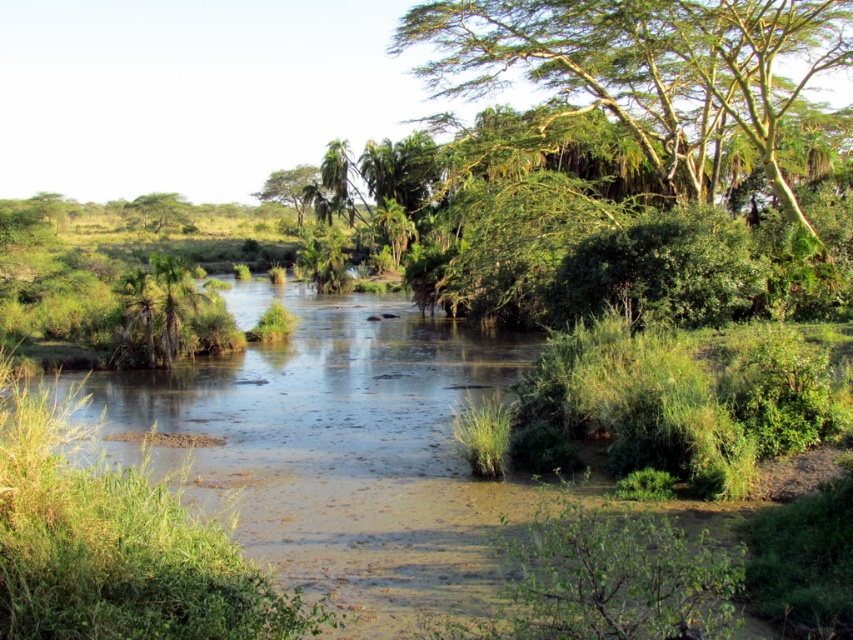
Question: Does green leafy tree at upper right have a greater width compared to green leafy tree at upper left?

Choices:
 (A) no
 (B) yes

Answer: (B)

Question: Considering the real-world distances, which object is farthest from the green leafy tree at upper right?

Choices:
 (A) green leafy tree at upper left
 (B) green leafy tree at center

Answer: (A)

Question: In this image, where is green leafy tree at upper right located relative to green leafy tree at center?

Choices:
 (A) above
 (B) below

Answer: (B)

Question: Which object appears closest to the camera in this image?

Choices:
 (A) green leafy tree at center
 (B) green leafy tree at upper right

Answer: (B)

Question: Is green leafy tree at upper right positioned behind green leafy tree at center?

Choices:
 (A) yes
 (B) no

Answer: (B)

Question: Among these points, which one is farthest from the camera?

Choices:
 (A) click(x=161, y=212)
 (B) click(x=669, y=115)
 (C) click(x=293, y=195)

Answer: (A)